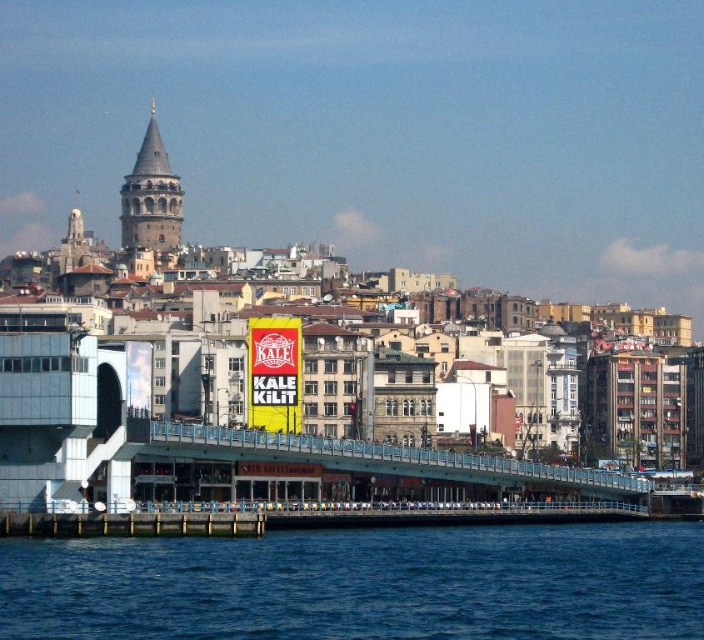
Can you confirm if blue metallic bridge at center is thinner than red/yellow sign at center?

No, blue metallic bridge at center is not thinner than red/yellow sign at center.

Consider the image. Does blue metallic bridge at center have a lesser height compared to red/yellow sign at center?

No.

Between point (339, 442) and point (264, 339), which one is positioned in front?

Point (339, 442) is more forward.

The height and width of the screenshot is (640, 704). Find the location of `blue metallic bridge at center`. blue metallic bridge at center is located at coordinates (382, 458).

Where is `blue water at lower left`? The height and width of the screenshot is (640, 704). blue water at lower left is located at coordinates (363, 584).

What do you see at coordinates (363, 584) in the screenshot? This screenshot has height=640, width=704. I see `blue water at lower left` at bounding box center [363, 584].

Find the location of `blue water at lower left`. blue water at lower left is located at coordinates (363, 584).

At what (x,y) coordinates should I click in order to perform the action: click on blue water at lower left. Please return your answer as a coordinate pair (x, y). This screenshot has height=640, width=704. Looking at the image, I should click on (363, 584).

Is blue water at lower left positioned in front of red/yellow sign at center?

Yes, it is in front of red/yellow sign at center.

Does point (282, 609) come farther from viewer compared to point (294, 358)?

No, it is in front of (294, 358).

Where is `blue water at lower left`? The image size is (704, 640). blue water at lower left is located at coordinates (363, 584).